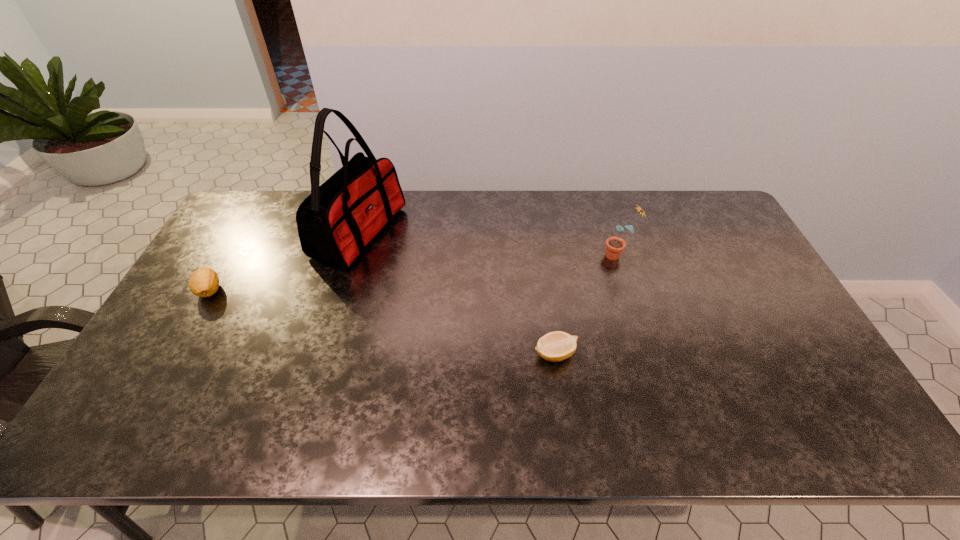
Locate an element on the screen. the second object from left to right is located at coordinates (337, 221).

Locate an element on the screen. the tallest object is located at coordinates (337, 221).

Find the location of a particular element. The image size is (960, 540). the second tallest object is located at coordinates (614, 245).

The width and height of the screenshot is (960, 540). In order to click on sunflower in this screenshot , I will do `click(614, 245)`.

Where is `the second shortest object`? Image resolution: width=960 pixels, height=540 pixels. the second shortest object is located at coordinates (204, 282).

What are the coordinates of `the left lemon` in the screenshot? It's located at (204, 282).

Where is `the right lemon`? the right lemon is located at coordinates (555, 346).

Identify the location of the shorter lemon. (555, 346).

Where is `free location located on the right of the third object from right to left`? This screenshot has height=540, width=960. free location located on the right of the third object from right to left is located at coordinates (426, 232).

Find the location of a particular element. vacant space situated on the flower of the third shortest object is located at coordinates (531, 255).